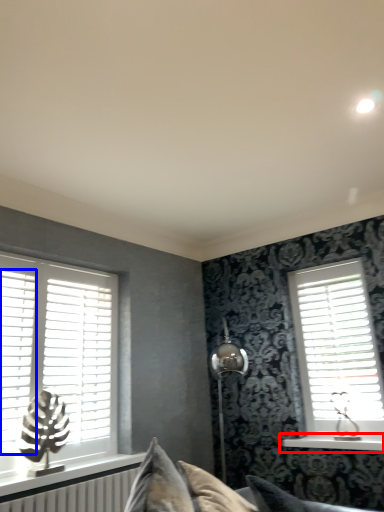
Question: Which of the following is the farthest to the observer, window sill (highlighted by a red box) or shutter (highlighted by a blue box)?

Choices:
 (A) window sill
 (B) shutter

Answer: (A)